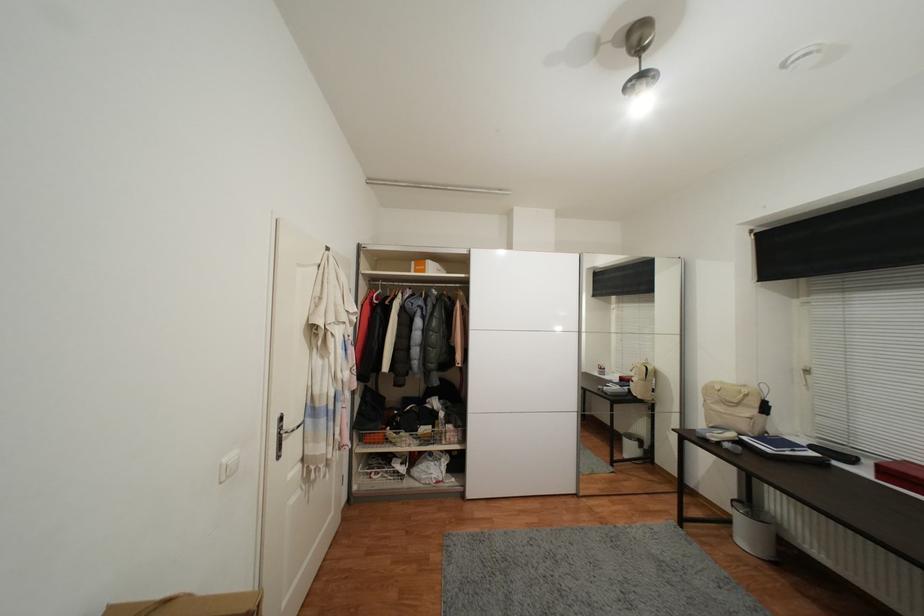
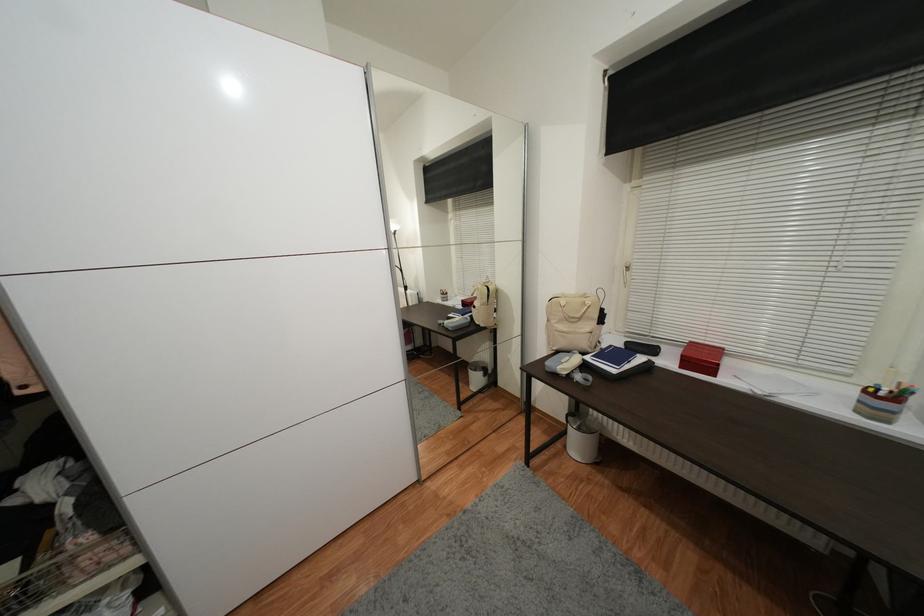
In the second image, find the point that corresponds to (x=745, y=392) in the first image.

(589, 305)